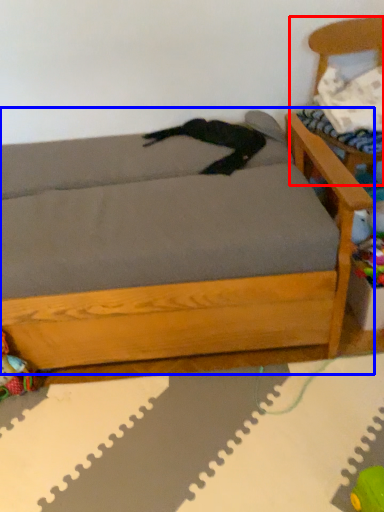
Question: Which object appears closest to the camera in this image, armchair (highlighted by a red box) or studio couch (highlighted by a blue box)?

Choices:
 (A) armchair
 (B) studio couch

Answer: (B)